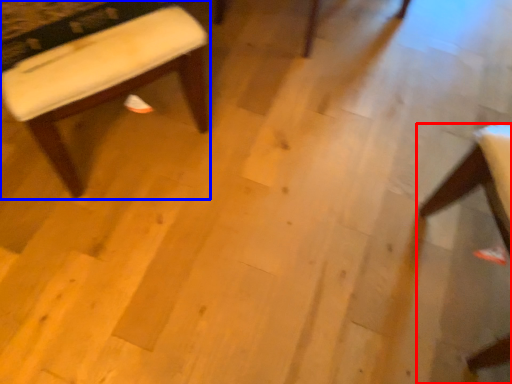
Question: Which of the following is the closest to the observer, chair (highlighted by a red box) or stool (highlighted by a blue box)?

Choices:
 (A) chair
 (B) stool

Answer: (A)